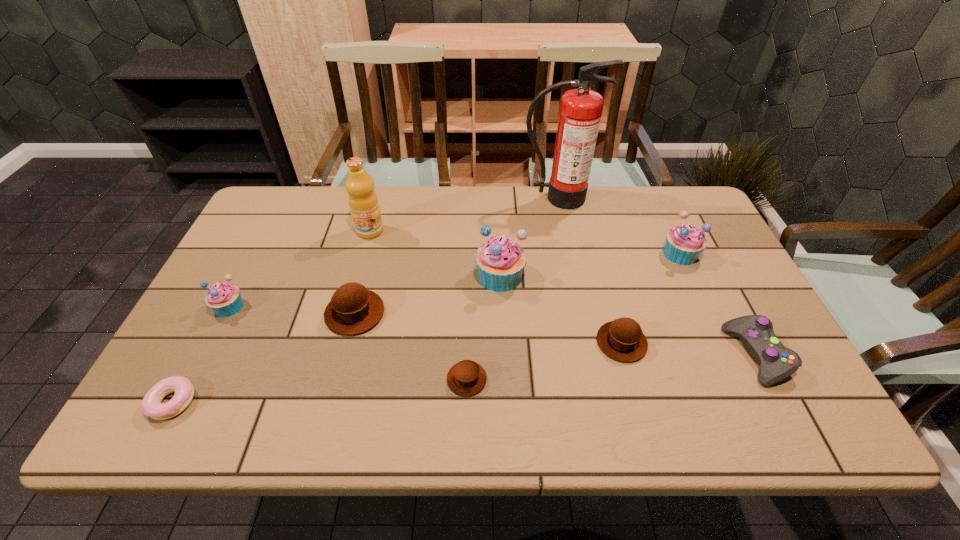
This screenshot has height=540, width=960. I want to click on free spot at the left edge of the desktop, so click(291, 237).

Locate an element on the screen. This screenshot has height=540, width=960. blank area at the right edge is located at coordinates (705, 288).

Locate an element on the screen. free space at the far left corner of the desktop is located at coordinates (281, 200).

In the image, there is a desktop. Where is `vacant region at the far right corner`? vacant region at the far right corner is located at coordinates 652,187.

At what (x,y) coordinates should I click in order to perform the action: click on free space between the tallest muffin and the smallest brown muffin. Please return your answer as a coordinate pair (x, y). The image size is (960, 540). Looking at the image, I should click on (484, 328).

Where is `vacant space in between the gray control and the second blue muffin from left to right`? vacant space in between the gray control and the second blue muffin from left to right is located at coordinates (629, 315).

The height and width of the screenshot is (540, 960). What are the coordinates of `free space between the smallest brown muffin and the fourth tallest object` in the screenshot? It's located at (573, 316).

The image size is (960, 540). I want to click on free space that is in between the control and the farthest object, so click(657, 276).

Where is `unoccupied position between the fire extinguisher and the gray control`? This screenshot has height=540, width=960. unoccupied position between the fire extinguisher and the gray control is located at coordinates (657, 276).

I want to click on free point between the smallest blue muffin and the doughnut, so click(x=201, y=354).